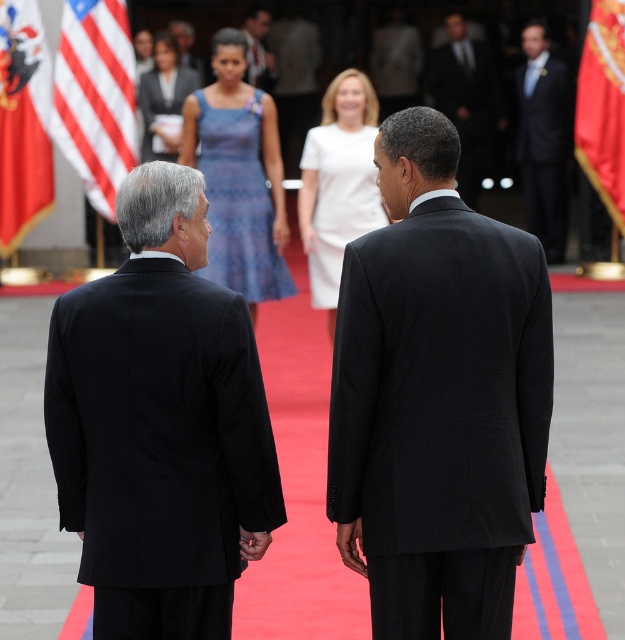
Question: Which point is closer to the camera?

Choices:
 (A) red fabric flag at left
 (B) black wool suit at left

Answer: (B)

Question: Among these points, which one is nearest to the camera?

Choices:
 (A) click(218, 433)
 (B) click(542, 58)
 (C) click(491, 61)

Answer: (A)

Question: Can you confirm if black wool suit at left is bigger than black suit at upper center?

Choices:
 (A) yes
 (B) no

Answer: (B)

Question: From the image, what is the correct spatial relationship of red-white striped flag at upper left in relation to black suit at upper center?

Choices:
 (A) above
 (B) below

Answer: (B)

Question: Can you confirm if blue lace dress at center is positioned to the left of smooth black suit at center?

Choices:
 (A) yes
 (B) no

Answer: (B)

Question: Which point appears farthest from the camera in this image?

Choices:
 (A) (618, 216)
 (B) (340, 273)
 (C) (225, 467)

Answer: (A)